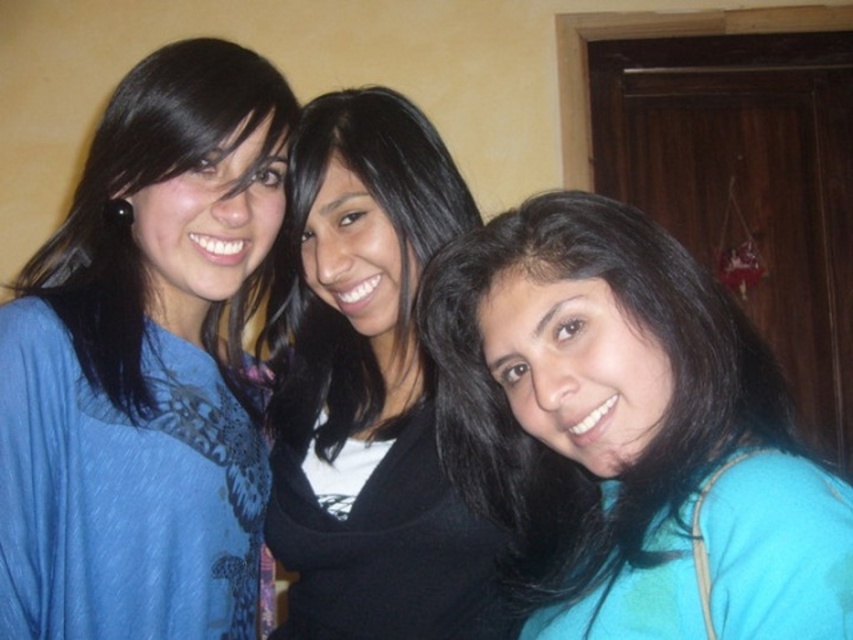
You are a photographer holding a camera. You want to take a photo of the matte blue blouse at left from a distance that ensures it fills the frame without being too close. Given that the camera has a standard lens with a focal length of 50mm, what is the minimum distance in inches you should maintain to achieve this?

The matte blue blouse at left and camera are 35.01 inches apart from each other. To ensure the blouse fills the frame without being too close, the minimum distance should be at least 35.01 inches.

You are a photographer trying to adjust the lighting for a group photo. You notice the matte blue blouse at left and the teal fabric at center. Which clothing item requires more careful lighting adjustments to avoid shadows due to its height difference?

The matte blue blouse at left requires more careful lighting adjustments because it has a greater height compared to the teal fabric at center, which may cast longer shadows and require more precise lighting to avoid unwanted shadows.

You are a fashion designer observing the image. You need to decide which fabric to recommend for a client who wants a more voluminous outfit. Based on the comparison between the matte blue blouse at left and the teal fabric at center, which one would you suggest?

The matte blue blouse at left has a larger size compared to teal fabric at center, so I would recommend the matte blue blouse at left for a more voluminous outfit.